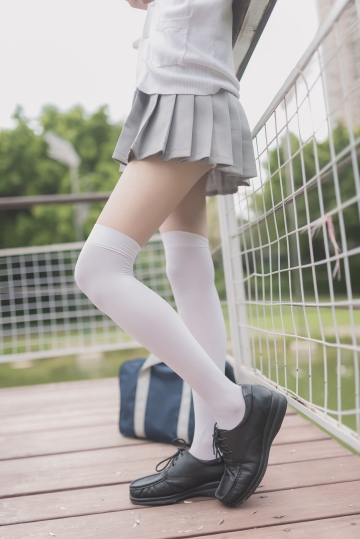
I want to click on sock, so click(x=141, y=334), click(x=203, y=331).